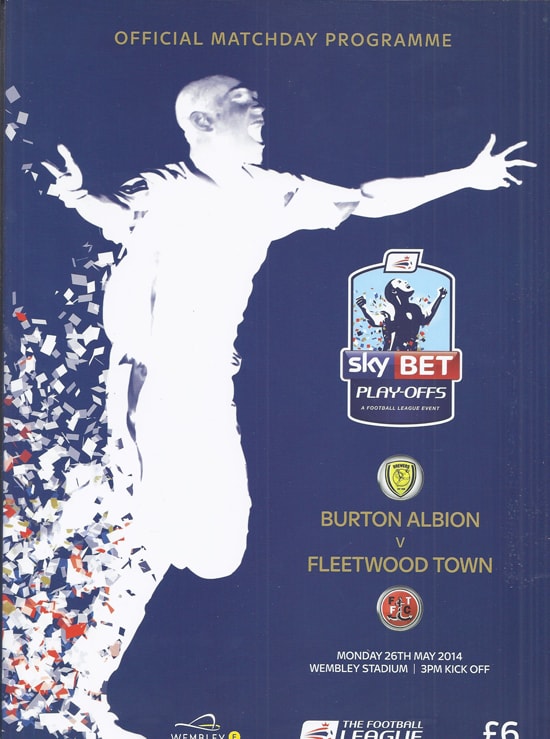
Find the location of a particular element. chest is located at coordinates (232, 217).